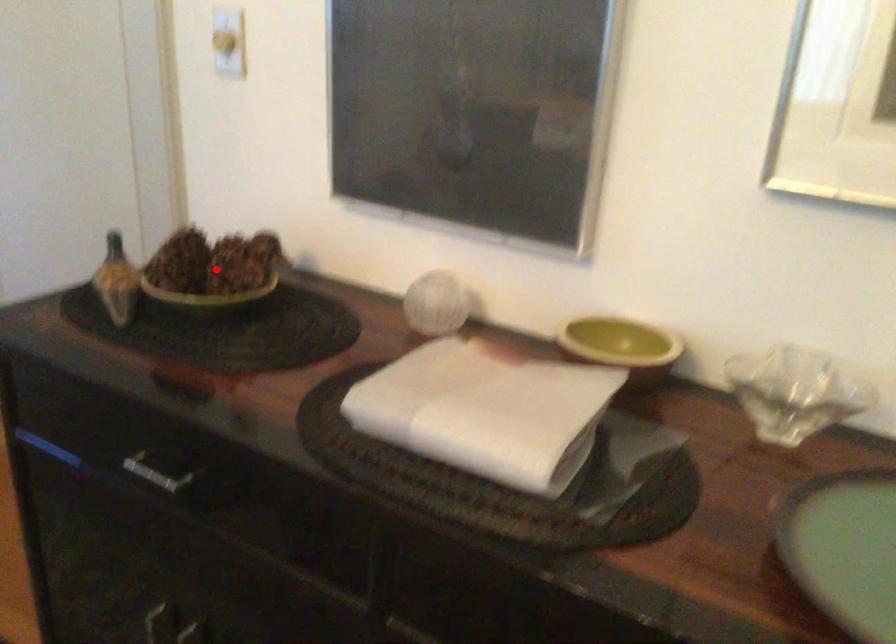
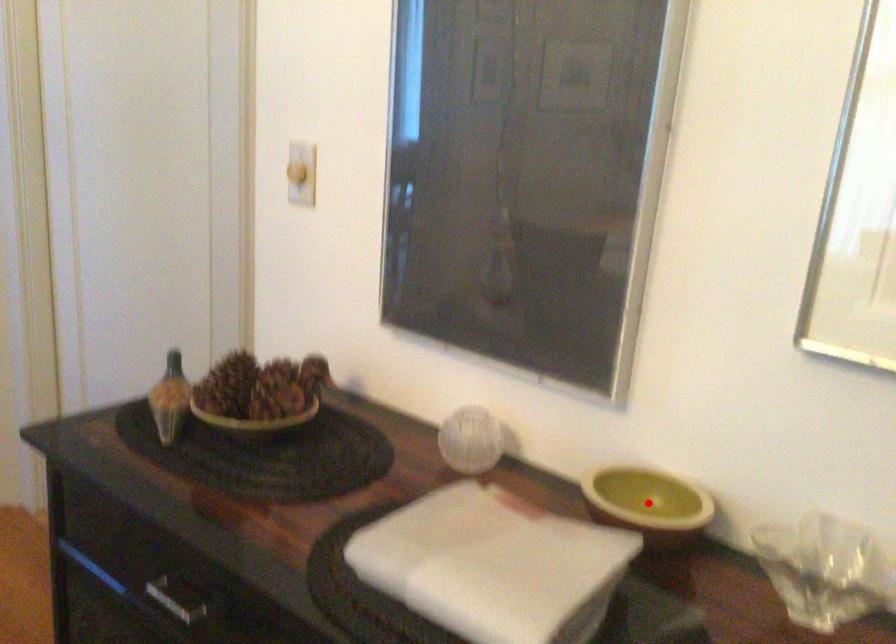
I am providing you with two images of the same scene from different viewpoints. A red point is marked on the first image and another point is marked on the second image. Does the point marked in image1 correspond to the same location as the one in image2?

No